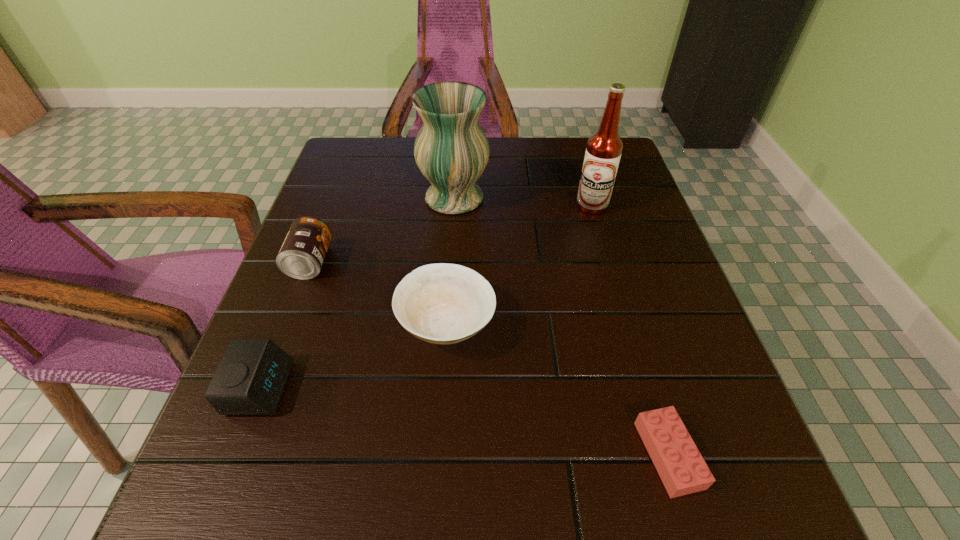
Find the location of a particular element. The image size is (960, 540). free point located on the front-facing side of the alarm clock is located at coordinates (468, 388).

This screenshot has width=960, height=540. Find the location of `vacant space located 0.260m on the left of the Lego`. vacant space located 0.260m on the left of the Lego is located at coordinates (459, 455).

This screenshot has height=540, width=960. Find the location of `object that is at the far edge`. object that is at the far edge is located at coordinates [451, 150].

This screenshot has height=540, width=960. What are the coordinates of `object that is at the near edge` in the screenshot? It's located at (682, 469).

Find the location of a particular element. The height and width of the screenshot is (540, 960). can that is positioned at the left edge is located at coordinates (301, 256).

You are a GUI agent. You are given a task and a screenshot of the screen. Output one action in this format:
    pyautogui.click(x=<x>, y=<y>)
    Task: Click on the alarm clock present at the left edge
    The image size is (960, 540).
    Given the screenshot: What is the action you would take?
    click(250, 380)

Locate an element on the screen. alcohol that is positioned at the right edge is located at coordinates (604, 148).

Image resolution: width=960 pixels, height=540 pixels. I want to click on Lego that is positioned at the right edge, so click(x=682, y=469).

What are the coordinates of `object present at the near right corner` in the screenshot? It's located at (682, 469).

I want to click on vacant space at the far edge of the desktop, so click(x=508, y=163).